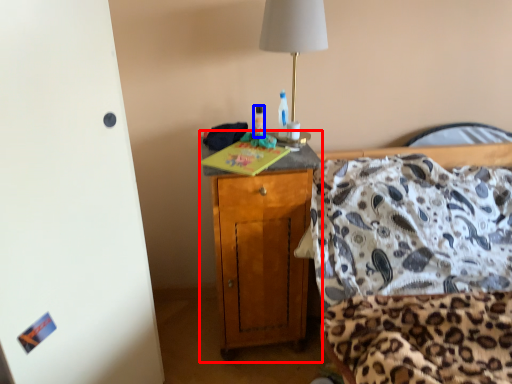
Question: Which object appears closest to the camera in this image, cabinetry (highlighted by a red box) or bottle (highlighted by a blue box)?

Choices:
 (A) cabinetry
 (B) bottle

Answer: (A)